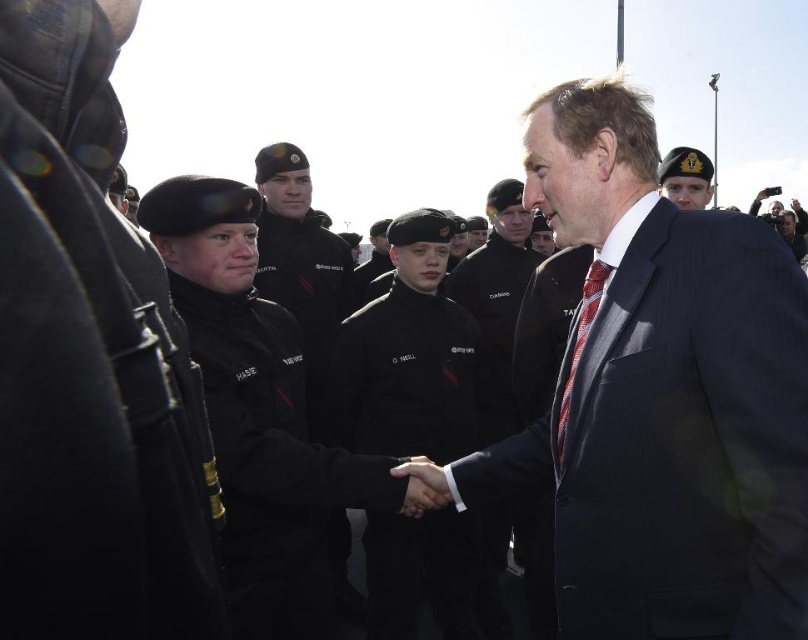
Which is in front, point (167, 234) or point (571, 346)?

Point (571, 346)

Does black matte uniform at center have a smaller size compared to red striped tie at right?

No.

Does point (242, 572) lie behind point (558, 422)?

Yes.

Identify the location of black matte uniform at center. This screenshot has width=808, height=640. (262, 417).

Is red striped tie at right to the left of dark blue uniform at center from the viewer's perspective?

Incorrect, red striped tie at right is not on the left side of dark blue uniform at center.

Who is more forward, (595, 300) or (384, 264)?

Point (595, 300) is in front.

Which is in front, point (567, 388) or point (383, 243)?

Point (567, 388) is in front.

Where is `red striped tie at right`? red striped tie at right is located at coordinates (579, 342).

Does dark blue suit at center come in front of red striped tie at right?

Yes, it is.

Which is behind, point (680, 618) or point (570, 369)?

Positioned behind is point (570, 369).

Identify the location of dark blue suit at center. (659, 396).